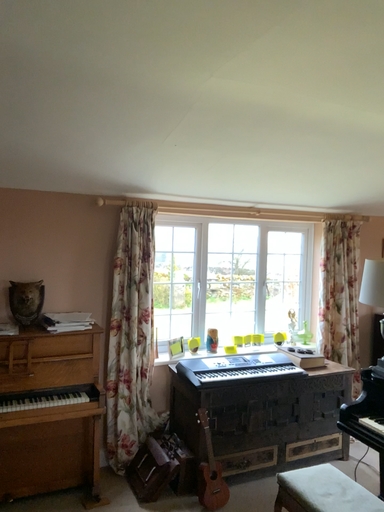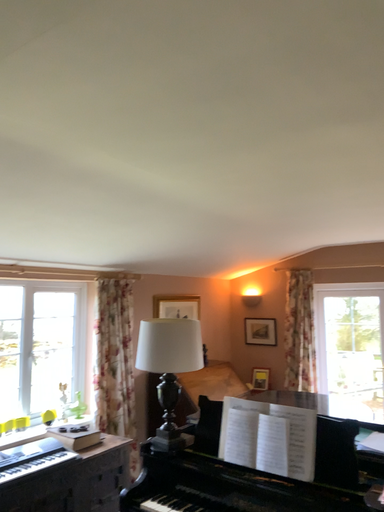
Question: How did the camera likely rotate when shooting the video?

Choices:
 (A) rotated upward
 (B) rotated downward

Answer: (A)